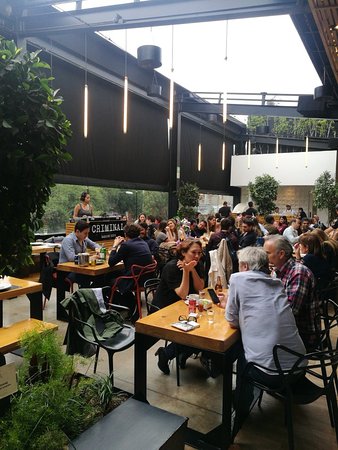
Where is `table`? Image resolution: width=338 pixels, height=450 pixels. table is located at coordinates (221, 343), (97, 272), (25, 287), (41, 251).